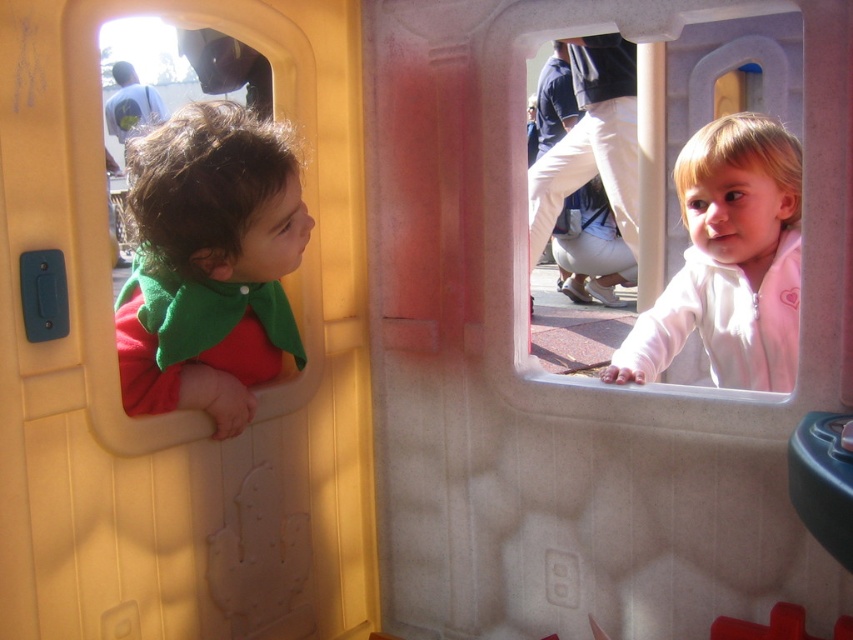
You are a parent trying to dress your child properly. You have a white fleece jacket at upper right and white cotton pants at center. According to the image, which clothing item is positioned lower on the child?

The white fleece jacket at upper right is below the white cotton pants at center, so the jacket is positioned lower on the child.

You are a parent trying to dress your child in the correct order. The child has a matte green cape at left and a white fleece jacket at upper right. Which item should you put on first according to their position in the image?

The matte green cape at left should be put on first because it is positioned to the left of the white fleece jacket at upper right, indicating it is closer to the body and likely worn underneath.

You are a parent trying to dress your child in the white fleece jacket at upper right and white cotton pants at center. Based on the image, which clothing item is wider?

The white fleece jacket at upper right is wider than the white cotton pants at center.